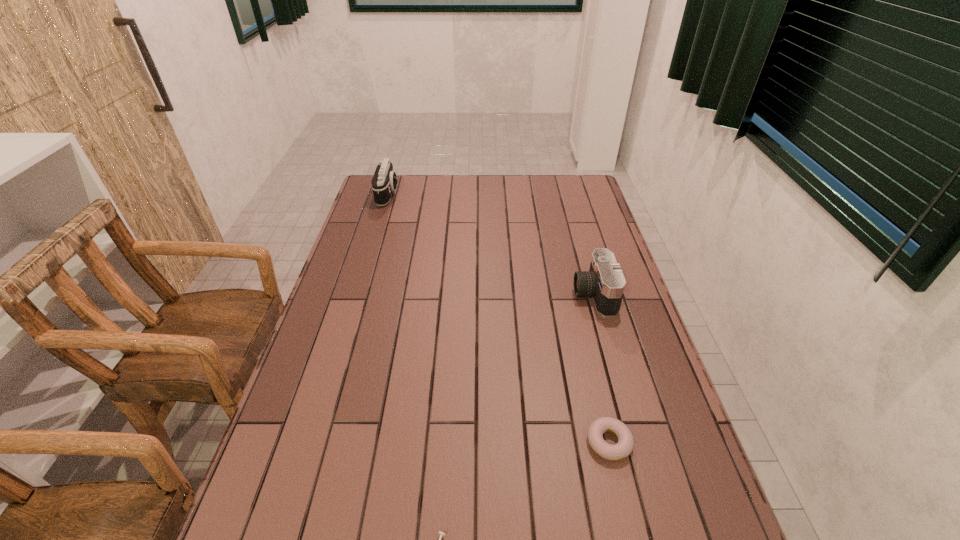
Locate an element on the screen. vacant space located on the left of the doughnut is located at coordinates click(524, 442).

Where is `object located at the far edge`? object located at the far edge is located at coordinates (384, 182).

At what (x,y) coordinates should I click in order to perform the action: click on object that is at the left edge. Please return your answer as a coordinate pair (x, y). Looking at the image, I should click on (384, 182).

You are a GUI agent. You are given a task and a screenshot of the screen. Output one action in this format:
    pyautogui.click(x=<x>, y=<y>)
    Task: Click on the camera that is at the right edge
    
    Given the screenshot: What is the action you would take?
    pyautogui.click(x=605, y=282)

At what (x,y) coordinates should I click in order to perform the action: click on doughnut positioned at the right edge. Please return your answer as a coordinate pair (x, y). The width and height of the screenshot is (960, 540). Looking at the image, I should click on (625, 445).

Locate an element on the screen. object at the far left corner is located at coordinates (384, 182).

In the image, there is a desktop. In order to click on vacant area at the far edge in this screenshot , I will do `click(478, 204)`.

The width and height of the screenshot is (960, 540). I want to click on free point at the left edge, so pyautogui.click(x=396, y=214).

You are a GUI agent. You are given a task and a screenshot of the screen. Output one action in this format:
    pyautogui.click(x=<x>, y=<y>)
    Task: Click on the free space at the right edge of the desktop
    This screenshot has height=540, width=960.
    Given the screenshot: What is the action you would take?
    tap(624, 303)

In the image, there is a desktop. Where is `vacant space at the far left corner`? This screenshot has width=960, height=540. vacant space at the far left corner is located at coordinates (372, 198).